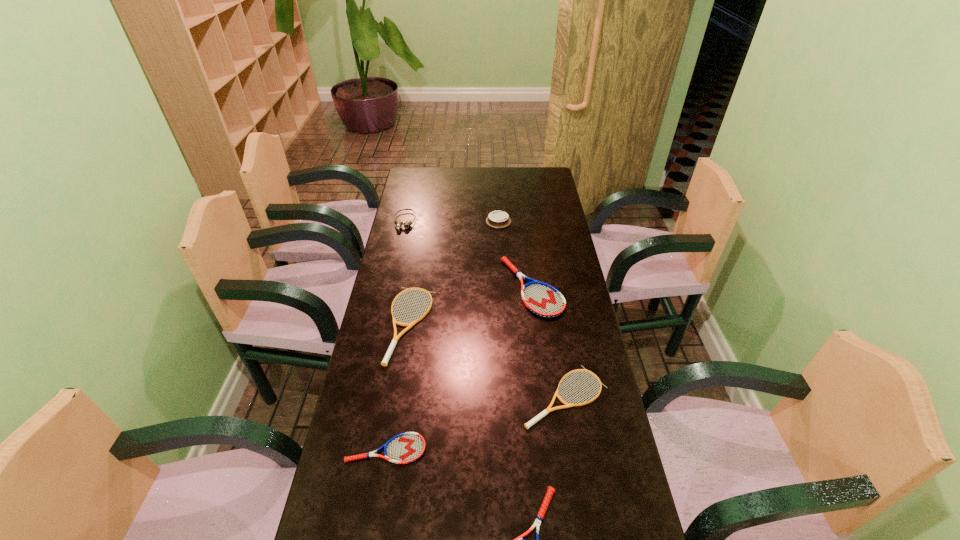
Image resolution: width=960 pixels, height=540 pixels. In order to click on beige tennis racket that can be found as the closest to the second smallest blue tennis racket in this screenshot , I will do `click(527, 425)`.

Where is `free space that satisfies the following two spatial constraints: 1. on the front lenses and sides of the leftmost blue tennis racket; 2. on the right side of the goggles`? Image resolution: width=960 pixels, height=540 pixels. free space that satisfies the following two spatial constraints: 1. on the front lenses and sides of the leftmost blue tennis racket; 2. on the right side of the goggles is located at coordinates (354, 449).

Locate an element on the screen. free space that satisfies the following two spatial constraints: 1. on the front lenses and sides of the goggles; 2. on the left side of the bigger beige tennis racket is located at coordinates (382, 325).

The image size is (960, 540). I want to click on free region that satisfies the following two spatial constraints: 1. on the front lenses and sides of the smaller beige tennis racket; 2. on the right side of the goggles, so click(x=366, y=396).

Find the location of `free point that satisfies the following two spatial constraints: 1. on the back side of the farthest blue tennis racket; 2. on the left side of the bigger beige tennis racket`. free point that satisfies the following two spatial constraints: 1. on the back side of the farthest blue tennis racket; 2. on the left side of the bigger beige tennis racket is located at coordinates (417, 287).

You are a GUI agent. You are given a task and a screenshot of the screen. Output one action in this format:
    pyautogui.click(x=<x>, y=<y>)
    Task: Click on the vacant space that satisfies the following two spatial constraints: 1. on the front lenses and sides of the goggles; 2. on the right side of the left beige tennis racket
    
    Given the screenshot: What is the action you would take?
    click(x=382, y=325)